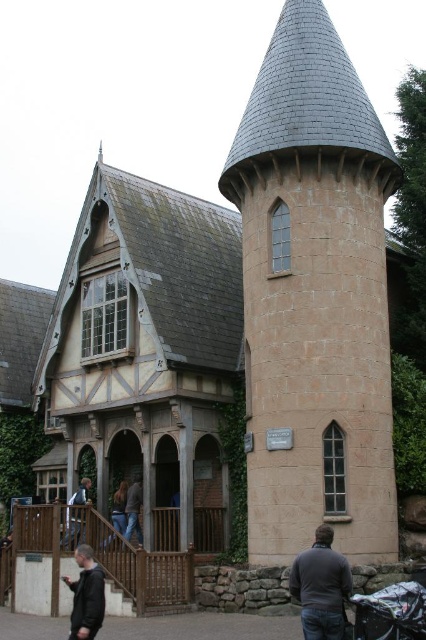
Question: Can you confirm if dark gray sweater at lower center is thinner than black fabric baby carriage at lower right?

Choices:
 (A) no
 (B) yes

Answer: (B)

Question: Among these points, which one is farthest from the camera?

Choices:
 (A) (135, 483)
 (B) (406, 616)
 (C) (81, 488)
 (D) (293, 568)

Answer: (A)

Question: Among these points, which one is farthest from the camera?

Choices:
 (A) (293, 596)
 (B) (86, 616)

Answer: (A)

Question: Does light brown wooden chair at lower center appear on the left side of jeans at lower center?

Choices:
 (A) no
 (B) yes

Answer: (B)

Question: Observing the image, what is the correct spatial positioning of dark gray sweater at lower center in reference to light brown wooden chair at lower center?

Choices:
 (A) above
 (B) below

Answer: (A)

Question: Which object is closer to the camera taking this photo?

Choices:
 (A) dark gray sweater at lower center
 (B) light brown wooden chair at lower center
 (C) beige stone tower at right
 (D) dark gray jacket at lower left

Answer: (A)